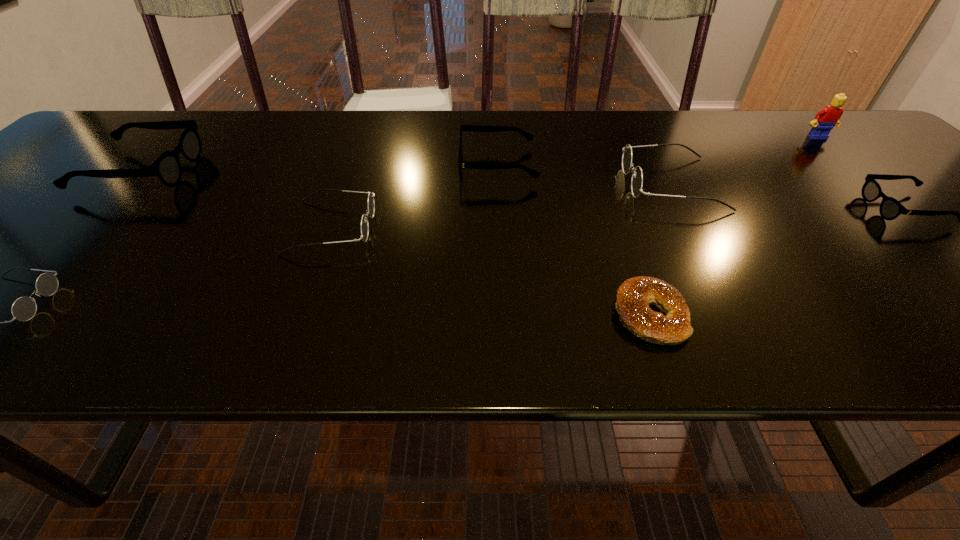
Where is `vacant area located 0.110m through the lenses of the third spectacles from left to right`? vacant area located 0.110m through the lenses of the third spectacles from left to right is located at coordinates (427, 227).

At what (x,y) coordinates should I click in order to perform the action: click on free region located 0.290m on the arms of the rightmost spectacles. Please return your answer as a coordinate pair (x, y). Looking at the image, I should click on (737, 208).

Where is `vacant space situated on the arms of the rightmost spectacles`? vacant space situated on the arms of the rightmost spectacles is located at coordinates (700, 208).

Locate an element on the screen. The width and height of the screenshot is (960, 540). free region located 0.150m on the arms of the rightmost spectacles is located at coordinates (803, 208).

The height and width of the screenshot is (540, 960). I want to click on blank area located on the right of the bagel, so click(858, 315).

The height and width of the screenshot is (540, 960). In order to click on Lego that is at the far edge in this screenshot , I will do `click(827, 118)`.

Where is `object present at the near edge`? Image resolution: width=960 pixels, height=540 pixels. object present at the near edge is located at coordinates (634, 296).

Find the location of a particular element. object that is at the left edge is located at coordinates (167, 167).

Where is `Lego present at the right edge`? The image size is (960, 540). Lego present at the right edge is located at coordinates [x=827, y=118].

Locate an element on the screen. This screenshot has height=540, width=960. spectacles positioned at the right edge is located at coordinates pyautogui.click(x=890, y=208).